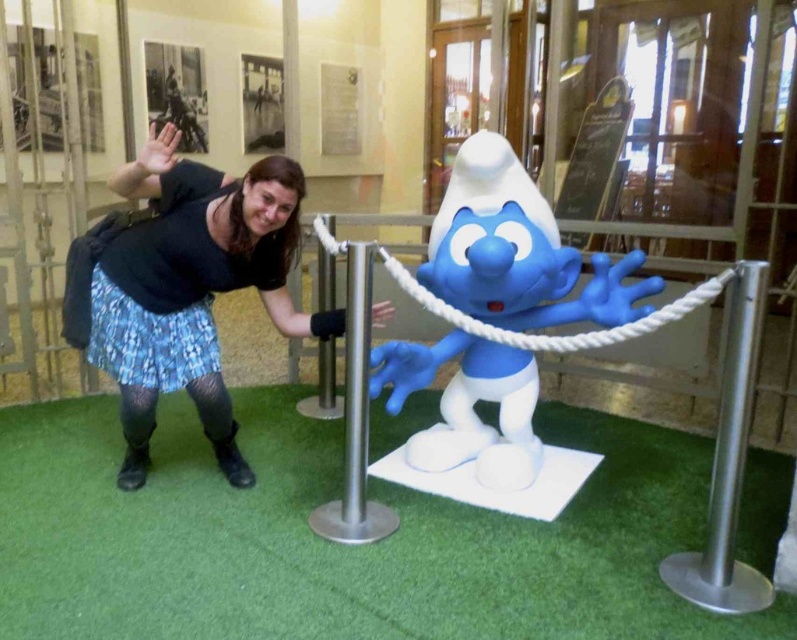
Question: Which of the following is the farthest from the observer?

Choices:
 (A) silver metallic pole at center
 (B) black fabric skirt at center

Answer: (A)

Question: Which of the following is the farthest from the observer?

Choices:
 (A) (532, 470)
 (B) (359, 289)

Answer: (A)

Question: Can you confirm if black fabric skirt at center is positioned to the right of silver metallic pole at center?

Choices:
 (A) no
 (B) yes

Answer: (A)

Question: Which object is positioned farthest from the silver metallic pole at center?

Choices:
 (A) black fabric skirt at center
 (B) blue plastic smurf at center

Answer: (B)

Question: Is black fabric skirt at center smaller than silver metallic pole at center?

Choices:
 (A) yes
 (B) no

Answer: (B)

Question: Is blue plastic smurf at center wider than silver metallic pole at center?

Choices:
 (A) no
 (B) yes

Answer: (B)